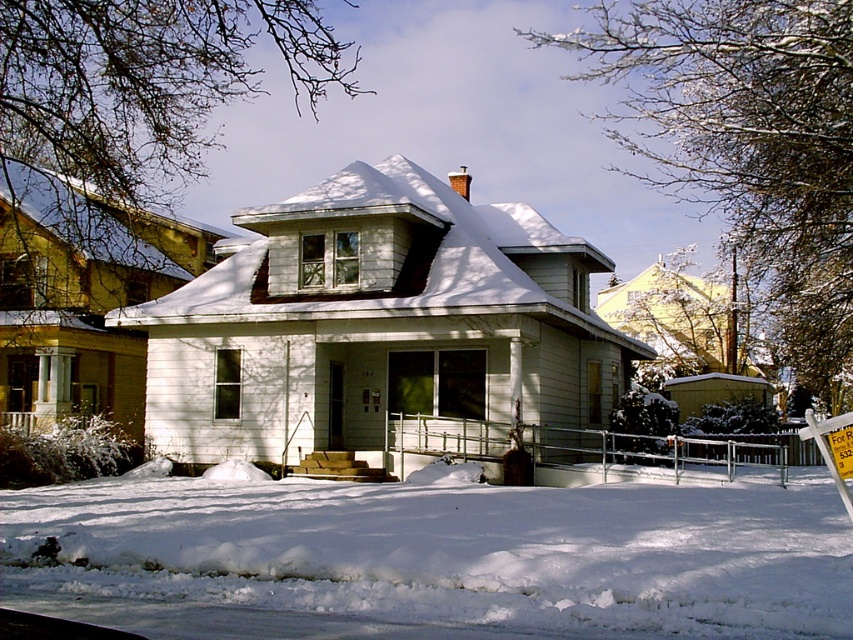
Question: Which object appears farthest from the camera in this image?

Choices:
 (A) white fluffy snow at lower center
 (B) white plastic sign at lower right

Answer: (B)

Question: Which point is closer to the camera?

Choices:
 (A) (764, 557)
 (B) (833, 419)

Answer: (B)

Question: Which object is closer to the camera taking this photo?

Choices:
 (A) white fluffy snow at lower center
 (B) white plastic sign at lower right

Answer: (A)

Question: Considering the relative positions of white fluffy snow at lower center and white plastic sign at lower right in the image provided, where is white fluffy snow at lower center located with respect to white plastic sign at lower right?

Choices:
 (A) left
 (B) right

Answer: (A)

Question: Can you confirm if white fluffy snow at lower center is positioned to the right of white plastic sign at lower right?

Choices:
 (A) no
 (B) yes

Answer: (A)

Question: Does white fluffy snow at lower center appear over white plastic sign at lower right?

Choices:
 (A) yes
 (B) no

Answer: (B)